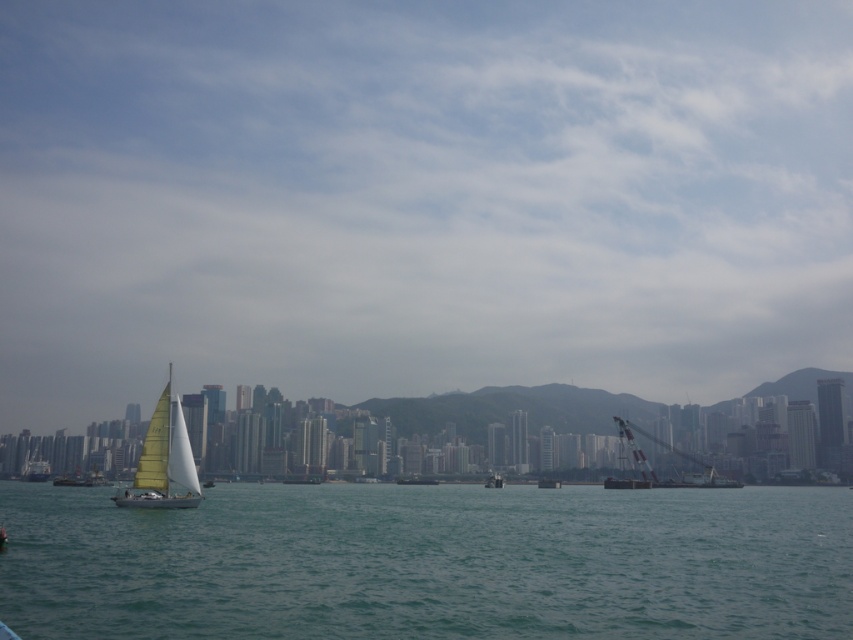
You are a photographer trying to capture the transparent glass sailboat at lower left and the green water at lower left in a single shot. Based on their sizes in the image, which object would appear larger in your photo?

The transparent glass sailboat at lower left appears larger in the photo because it is taller than the green water at lower left.

You are standing on a pier and see the green water at lower left and the metallic gray boat at center. Which object is nearer to you?

The green water at lower left is closer to the viewer than the metallic gray boat at center.

You are standing at the waterfront and see two points marked on the water. The first point is at coordinates point (698, 484) and the second point is at point (503, 483). Which point is closer to you?

Point (698, 484) is in front of point (503, 483), so it is closer to you.